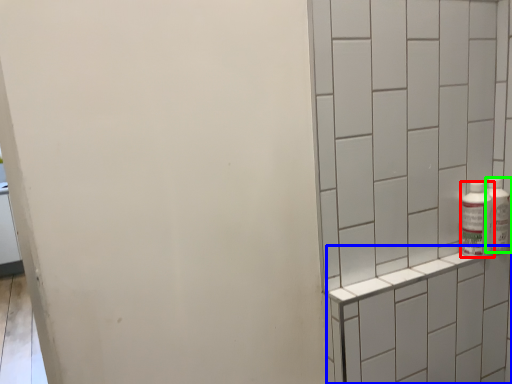
Question: Which object is positioned closest to bottle (highlighted by a red box)? Select from shelf (highlighted by a blue box) and bottle (highlighted by a green box).

Choices:
 (A) shelf
 (B) bottle

Answer: (B)